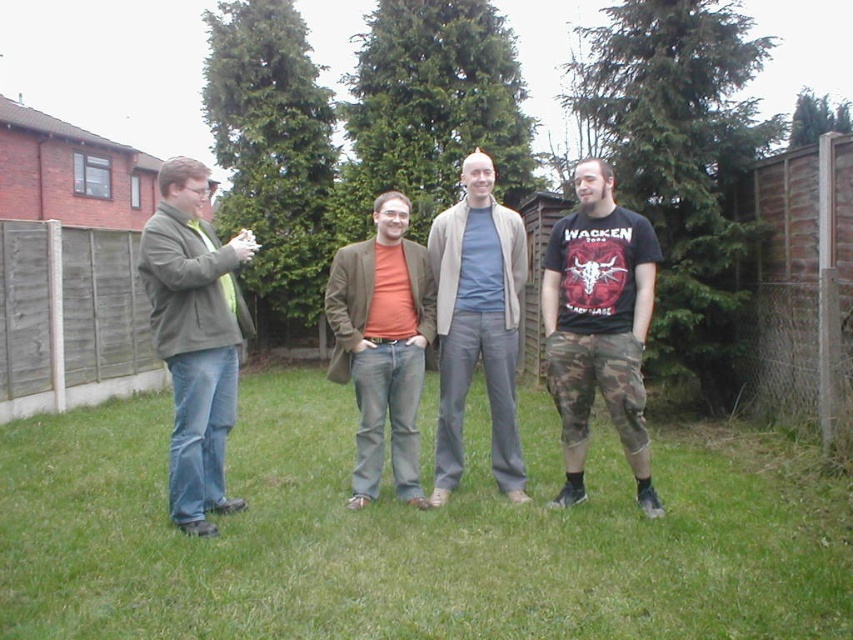
Is point (575, 342) more distant than point (421, 506)?

No.

Is camo pants at center further to the viewer compared to matte brown blazer at center?

No, it is in front of matte brown blazer at center.

Is point (624, 291) behind point (393, 465)?

No, it is not.

Locate an element on the screen. The width and height of the screenshot is (853, 640). camo pants at center is located at coordinates (598, 324).

How distant is matte green jacket at left from light gray cotton pants at center?

matte green jacket at left is 4.71 feet from light gray cotton pants at center.

Is matte green jacket at left closer to camera compared to light gray cotton pants at center?

Yes, matte green jacket at left is in front of light gray cotton pants at center.

Is point (213, 509) closer to viewer compared to point (503, 376)?

Yes, point (213, 509) is in front of point (503, 376).

The width and height of the screenshot is (853, 640). Identify the location of matte green jacket at left. (195, 337).

How much distance is there between green grass at lower center and camo pants at center?

green grass at lower center and camo pants at center are 1.36 meters apart.

Consider the image. Is green grass at lower center closer to camera compared to camo pants at center?

Yes.

Is point (328, 624) positioned in front of point (583, 248)?

That is True.

Locate an element on the screen. green grass at lower center is located at coordinates (393, 538).